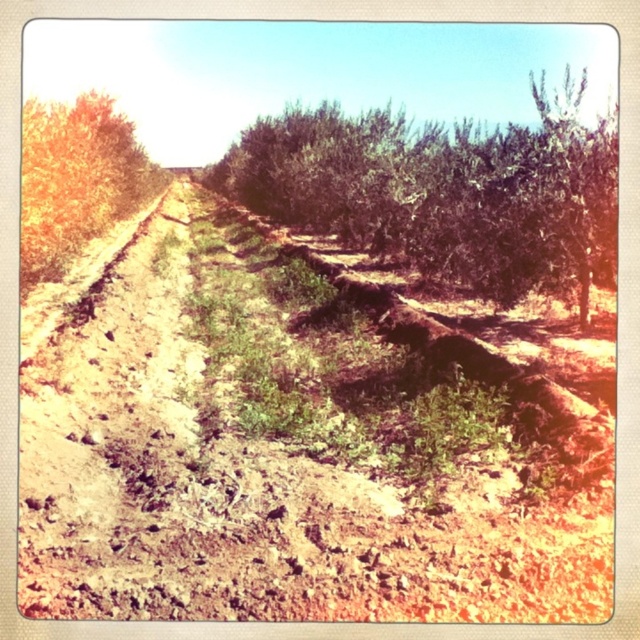
Question: Which point is farther to the camera?

Choices:
 (A) (113, 186)
 (B) (545, 118)
 (C) (579, 529)

Answer: (A)

Question: In this image, where is brown soil at center located relative to green leafy shrub at center?

Choices:
 (A) below
 (B) above

Answer: (A)

Question: From the image, what is the correct spatial relationship of brown soil at center in relation to green leafy shrub at center?

Choices:
 (A) below
 (B) above

Answer: (A)

Question: Can you confirm if brown soil at center is positioned to the right of green leafy tree at left?

Choices:
 (A) yes
 (B) no

Answer: (A)

Question: Which object is the closest to the brown soil at center?

Choices:
 (A) green leafy shrub at center
 (B) green leafy tree at left

Answer: (B)

Question: Among these objects, which one is nearest to the camera?

Choices:
 (A) green leafy tree at left
 (B) green leafy shrub at center

Answer: (B)